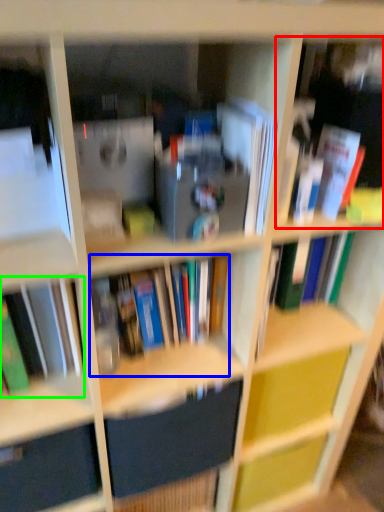
Question: Which object is positioned farthest from book (highlighted by a red box)? Select from book (highlighted by a blue box) and book (highlighted by a green box).

Choices:
 (A) book
 (B) book

Answer: (B)